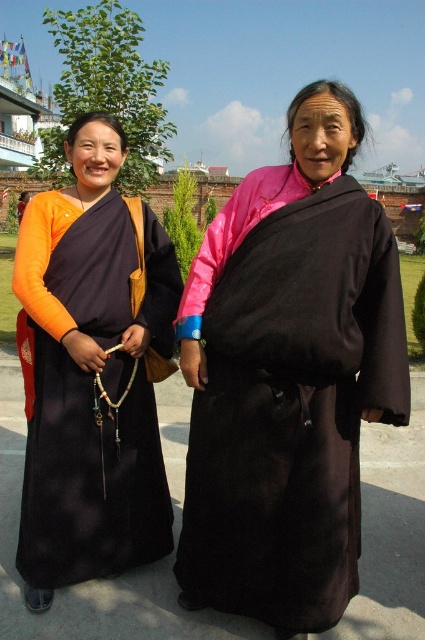
Question: Does black silk dress at center appear under matte black robe at left?

Choices:
 (A) yes
 (B) no

Answer: (A)

Question: Which object appears closest to the camera in this image?

Choices:
 (A) black silk dress at center
 (B) matte black robe at left

Answer: (A)

Question: Which point is farther from the camera taking this photo?

Choices:
 (A) (152, 404)
 (B) (379, 248)

Answer: (A)

Question: Observing the image, what is the correct spatial positioning of black silk dress at center in reference to matte black robe at left?

Choices:
 (A) above
 (B) below

Answer: (B)

Question: Which of the following is the closest to the observer?

Choices:
 (A) black silk dress at center
 (B) matte black robe at left

Answer: (A)

Question: Does black silk dress at center have a smaller size compared to matte black robe at left?

Choices:
 (A) no
 (B) yes

Answer: (A)